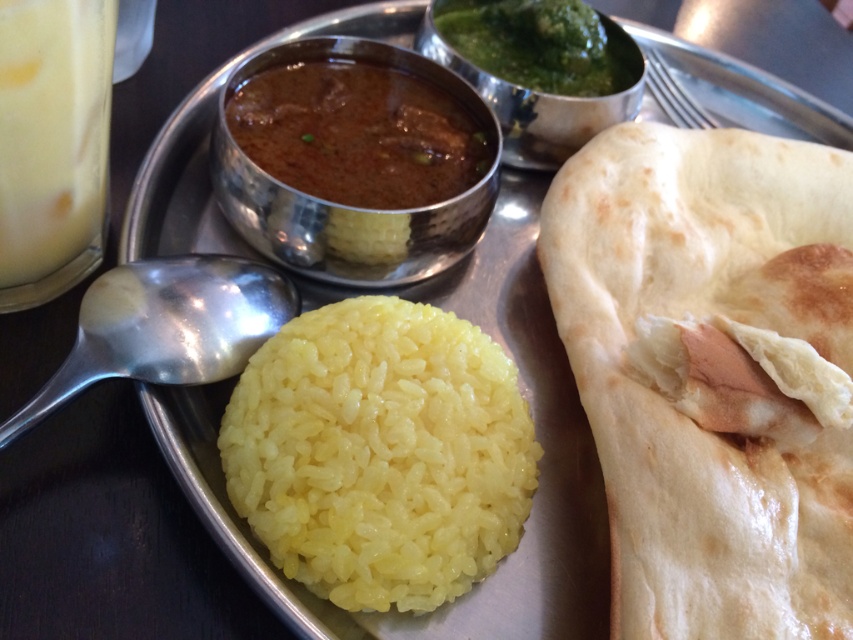
Question: Based on their relative distances, which object is nearer to the golden brown dough at right?

Choices:
 (A) yellow polished rice at center
 (B) brown matte curry at center
 (C) green paste at upper center

Answer: (A)

Question: Which of the following is the closest to the observer?

Choices:
 (A) (585, 340)
 (B) (253, 465)

Answer: (B)

Question: Is brown matte curry at center below milky white liquid at left?

Choices:
 (A) no
 (B) yes

Answer: (A)

Question: From the image, what is the correct spatial relationship of yellow polished rice at center in relation to brown matte curry at center?

Choices:
 (A) above
 (B) below

Answer: (B)

Question: Which point is farther from the camera taking this photo?

Choices:
 (A) (601, 72)
 (B) (843, 564)
 (C) (4, 131)
 (D) (334, 538)

Answer: (A)

Question: Is brown matte curry at center positioned in front of milky white liquid at left?

Choices:
 (A) no
 (B) yes

Answer: (A)